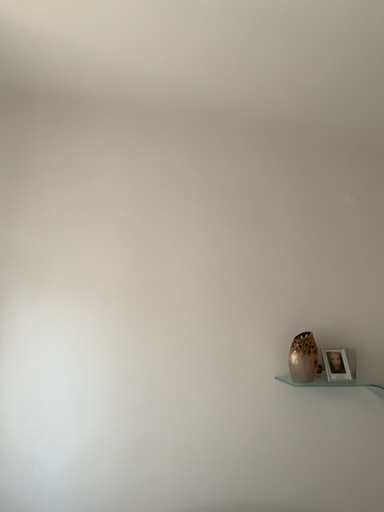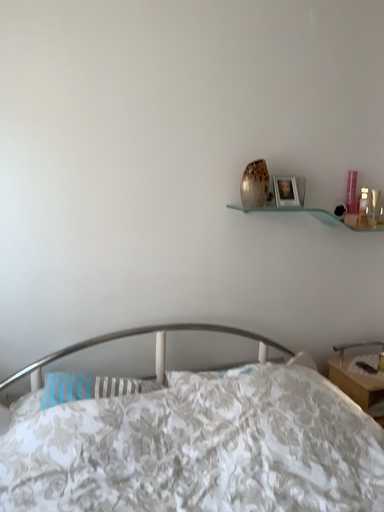
Question: How did the camera likely rotate when shooting the video?

Choices:
 (A) rotated upward
 (B) rotated downward

Answer: (B)